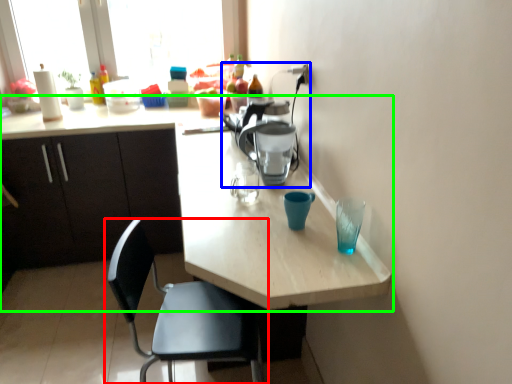
Question: Which object is positioned closest to chair (highlighted by a red box)? Select from coffeepot (highlighted by a blue box) and kitchen & dining room table (highlighted by a green box).

Choices:
 (A) coffeepot
 (B) kitchen & dining room table

Answer: (B)